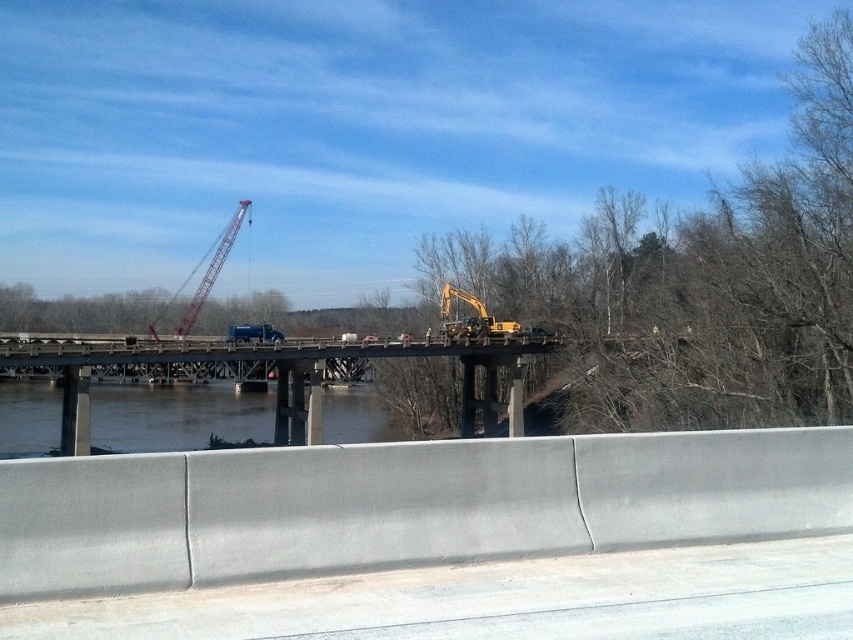
You are a construction worker standing on the concrete bridge at center. You need to move a heavy load from one side of the bridge to the other. The load is too large to fit under the metallic red crane at center. Can you move the load across the bridge without going under the crane?

The concrete bridge at center is wider than the metallic red crane at center. Since the load is too large to fit under the crane, you can move it across the bridge by staying on the side opposite to the crane, as the bridge is wider than the crane itself.